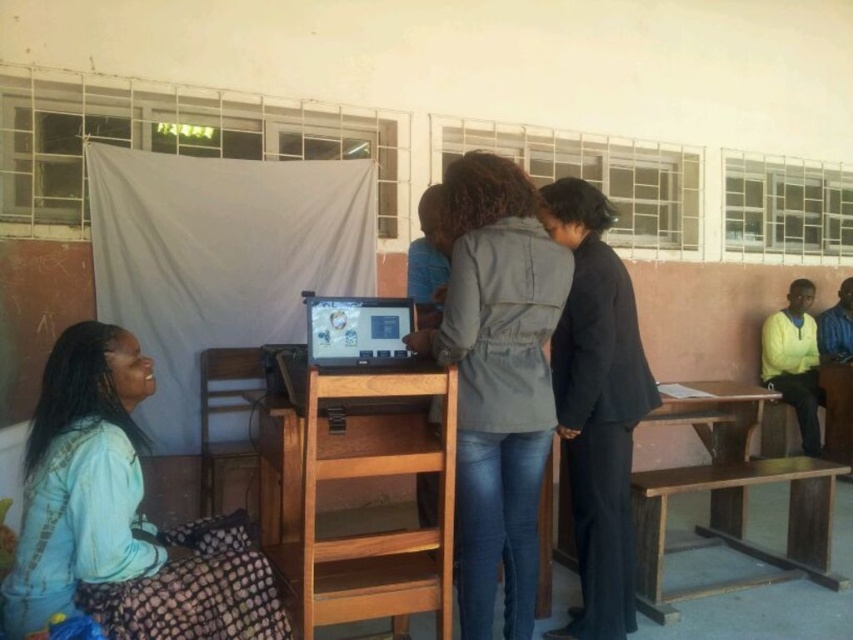
Question: Does light blue fabric skirt at lower left appear under brown wooden table at lower right?

Choices:
 (A) no
 (B) yes

Answer: (A)

Question: Which point is closer to the camera?

Choices:
 (A) (378, 358)
 (B) (827, 568)
 (C) (485, 180)
 (D) (103, 464)

Answer: (D)

Question: Which point is farther to the camera?

Choices:
 (A) (491, 285)
 (B) (83, 364)

Answer: (A)

Question: Which point is farther to the camera?

Choices:
 (A) brown wooden table at lower right
 (B) black matte suit at center
 (C) matte black computer at center
 (D) yellow matte shirt at right

Answer: (D)

Question: Can you confirm if denim jacket at center is wider than yellow matte shirt at right?

Choices:
 (A) yes
 (B) no

Answer: (A)

Question: Does denim jacket at center have a smaller size compared to yellow matte shirt at right?

Choices:
 (A) yes
 (B) no

Answer: (B)